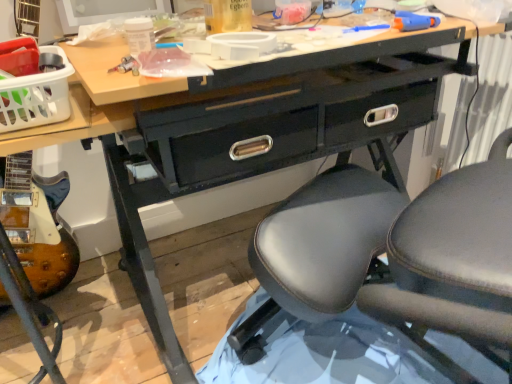
What do you see at coordinates (453, 261) in the screenshot?
I see `black leather chair at center` at bounding box center [453, 261].

Identify the location of black leather chair at center. (453, 261).

Is wooden electric guitar at lower left far from black leather chair at center?

No, wooden electric guitar at lower left is not far away from black leather chair at center.

Is wooden electric guitar at lower left shorter than black leather chair at center?

Yes.

From the image's perspective, is wooden electric guitar at lower left positioned above or below black leather chair at center?

Clearly, from the image's perspective, wooden electric guitar at lower left is below black leather chair at center.

From the picture: From a real-world perspective, which is physically above, wooden electric guitar at lower left or black leather chair at center?

black leather chair at center, from a real-world perspective.

From a real-world perspective, between wooden electric guitar at lower left and white plastic basket at upper left, who is vertically lower?

From a 3D spatial view, wooden electric guitar at lower left is below.

From their relative heights in the image, would you say wooden electric guitar at lower left is taller or shorter than white plastic basket at upper left?

wooden electric guitar at lower left is taller than white plastic basket at upper left.

Is wooden electric guitar at lower left wider or thinner than white plastic basket at upper left?

Considering their sizes, wooden electric guitar at lower left looks broader than white plastic basket at upper left.

From a real-world perspective, is white plastic basket at upper left physically below wooden electric guitar at lower left?

Actually, white plastic basket at upper left is physically above wooden electric guitar at lower left in the real world.

Can you confirm if white plastic basket at upper left is thinner than wooden electric guitar at lower left?

Indeed, white plastic basket at upper left has a lesser width compared to wooden electric guitar at lower left.

From the image's perspective, which object appears higher, white plastic basket at upper left or wooden electric guitar at lower left?

white plastic basket at upper left.

Considering the relative sizes of white plastic basket at upper left and wooden electric guitar at lower left in the image provided, is white plastic basket at upper left taller than wooden electric guitar at lower left?

No, white plastic basket at upper left is not taller than wooden electric guitar at lower left.

Between white plastic basket at upper left and black leather chair at center, which one is positioned behind?

white plastic basket at upper left is further from the camera.

Considering the relative sizes of white plastic basket at upper left and black leather chair at center in the image provided, is white plastic basket at upper left thinner than black leather chair at center?

Yes, white plastic basket at upper left is thinner than black leather chair at center.

Is white plastic basket at upper left facing away from black leather chair at center?

That's not correct — white plastic basket at upper left is not looking away from black leather chair at center.

Which of these two, white plastic basket at upper left or black leather chair at center, is smaller?

Smaller between the two is white plastic basket at upper left.

Are black leather chair at center and white plastic basket at upper left beside each other?

No.

From the image's perspective, which object appears higher, black leather chair at center or white plastic basket at upper left?

white plastic basket at upper left, from the image's perspective.

This screenshot has height=384, width=512. Identify the location of basket that is above the black leather chair at center (from a real-world perspective). (36, 93).

Is black leather chair at center wider or thinner than white plastic basket at upper left?

black leather chair at center is wider than white plastic basket at upper left.

Does black leather chair at center have a lesser height compared to wooden electric guitar at lower left?

Incorrect, the height of black leather chair at center does not fall short of that of wooden electric guitar at lower left.

Are black leather chair at center and wooden electric guitar at lower left far apart?

No.

Between point (437, 190) and point (2, 189), which one is positioned in front?

The point (437, 190) is closer.

Is wooden electric guitar at lower left at the back of black leather chair at center?

No, wooden electric guitar at lower left is not at the back of black leather chair at center.

Locate an element on the screen. This screenshot has width=512, height=384. equipment on the left of black leather chair at center is located at coordinates (37, 224).

I want to click on equipment in front of the white plastic basket at upper left, so click(x=37, y=224).

Looking at the image, which one is located closer to black leather chair at center, wooden electric guitar at lower left or white plastic basket at upper left?

Among the two, white plastic basket at upper left is located nearer to black leather chair at center.

Based on their spatial positions, is black leather chair at center or wooden electric guitar at lower left further from white plastic basket at upper left?

The object further to white plastic basket at upper left is black leather chair at center.

When comparing their distances from black leather chair at center, does white plastic basket at upper left or wooden electric guitar at lower left seem closer?

Among the two, white plastic basket at upper left is located nearer to black leather chair at center.

Which object lies further to the anchor point white plastic basket at upper left, wooden electric guitar at lower left or black leather chair at center?

black leather chair at center is positioned further to the anchor white plastic basket at upper left.

Which object lies further to the anchor point wooden electric guitar at lower left, black leather chair at center or white plastic basket at upper left?

Based on the image, black leather chair at center appears to be further to wooden electric guitar at lower left.

Based on their spatial positions, is white plastic basket at upper left or black leather chair at center further from wooden electric guitar at lower left?

black leather chair at center.

The image size is (512, 384). In order to click on basket situated between wooden electric guitar at lower left and black leather chair at center from left to right in this screenshot , I will do `click(36, 93)`.